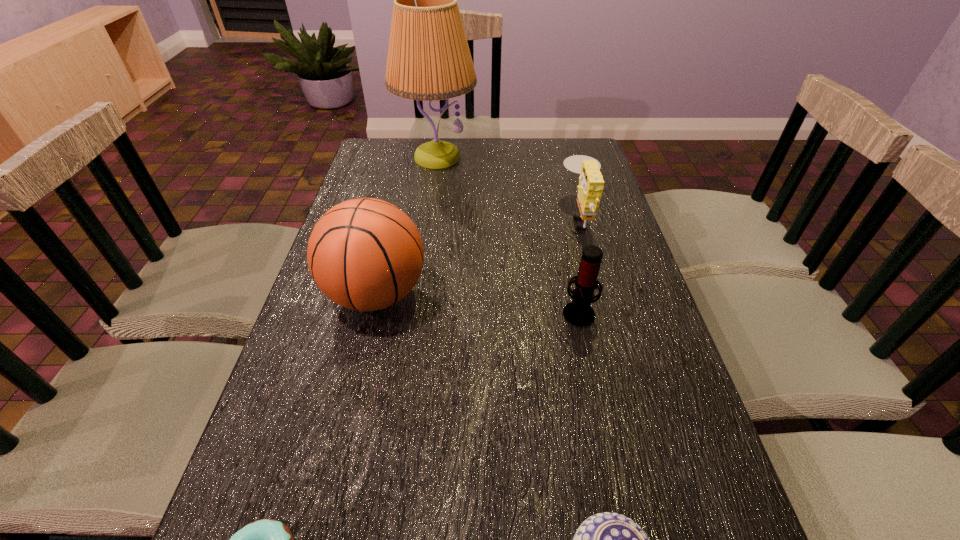
Locate an element on the screen. The height and width of the screenshot is (540, 960). the farthest object is located at coordinates (429, 59).

Image resolution: width=960 pixels, height=540 pixels. I want to click on lamp, so click(429, 59).

Identify the location of basketball. (365, 254).

Find the location of `microphone`. microphone is located at coordinates (x=579, y=313).

Locate an element on the screen. Image resolution: width=960 pixels, height=540 pixels. sponge is located at coordinates (591, 182).

You are a GUI agent. You are given a task and a screenshot of the screen. Output one action in this format:
    pyautogui.click(x=<x>, y=<y>)
    Task: Click on the vacant space located on the side of the farthest object near the pull switch
    This screenshot has height=540, width=960.
    Given the screenshot: What is the action you would take?
    pyautogui.click(x=431, y=195)

Find the location of a particular element. This screenshot has width=960, height=540. vacant space located on the right of the basketball is located at coordinates (539, 294).

The width and height of the screenshot is (960, 540). Identify the location of free space located on the front of the microphone. (600, 415).

Where is `free space located on the front-facing side of the fifth nearest object`? The height and width of the screenshot is (540, 960). free space located on the front-facing side of the fifth nearest object is located at coordinates (539, 216).

Identify the location of vacant space located 0.140m on the front-facing side of the fifth nearest object. The image size is (960, 540). (516, 216).